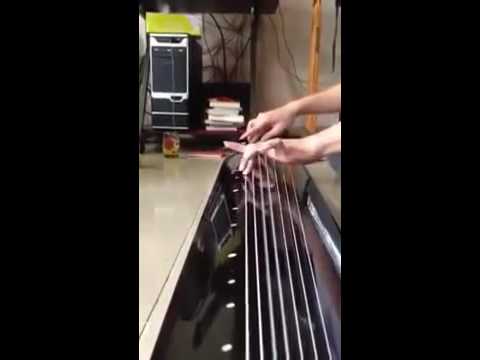
You are a GUI agent. You are given a task and a screenshot of the screen. Output one action in this format:
    pyautogui.click(x=<x>, y=<y>)
    Task: Click on the box
    The image size is (480, 360).
    Given the screenshot: What is the action you would take?
    pyautogui.click(x=173, y=24)